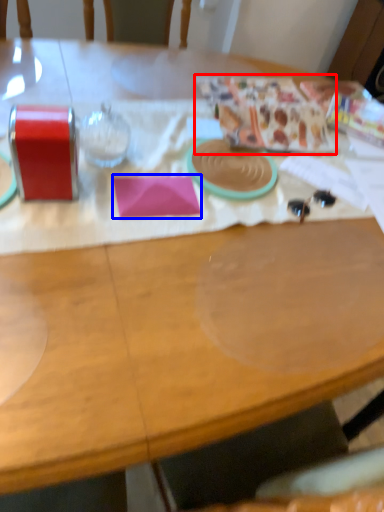
Question: Which of the following is the farthest to the observer, wrapping paper (highlighted by a red box) or notepad (highlighted by a blue box)?

Choices:
 (A) wrapping paper
 (B) notepad

Answer: (A)